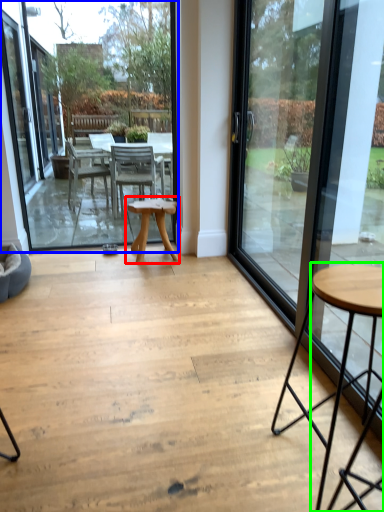
Question: Which is nearer to the table (highlighted by a red box)? window screen (highlighted by a blue box) or coffee table (highlighted by a green box).

Choices:
 (A) window screen
 (B) coffee table

Answer: (A)